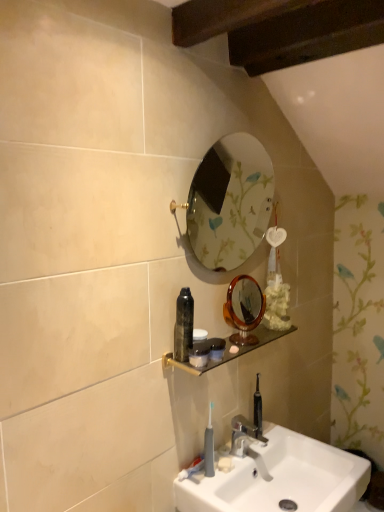
I want to click on free space above wooden shelf at center (from a real-world perspective), so click(x=236, y=344).